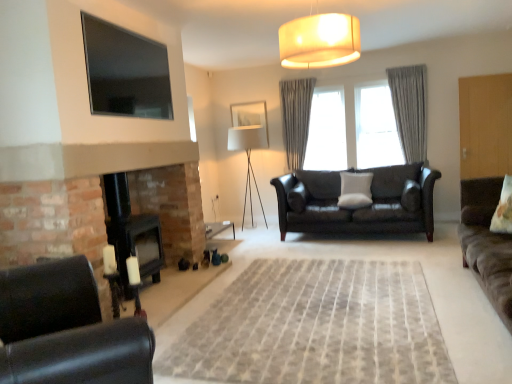
Question: From the image's perspective, is gray textured curtain at center, the first curtain in the right-to-left sequence, positioned above or below white fabric lamp at center?

Choices:
 (A) below
 (B) above

Answer: (B)

Question: Is point (402, 84) closer or farther from the camera than point (254, 127)?

Choices:
 (A) farther
 (B) closer

Answer: (B)

Question: Which is farther from the gray textured curtain at center, which appears as the 1th curtain when viewed from the left?

Choices:
 (A) white soft cushion at center, which is the 2th pillow in right-to-left order
 (B) gray textured curtain at center, the 2th curtain positioned from the left
 (C) neutral woven rug at center
 (D) matte beige lampshade at upper center
 (E) white fabric picture frame at center

Answer: (C)

Question: Considering the real-world distances, which object is farthest from the suede brown sofa at right, acting as the 1th studio couch starting from the front?

Choices:
 (A) black leather chair at lower left
 (B) gray textured curtain at center, the first curtain in the right-to-left sequence
 (C) neutral woven rug at center
 (D) matte beige lampshade at upper center
 (E) black matte fireplace at lower left

Answer: (E)